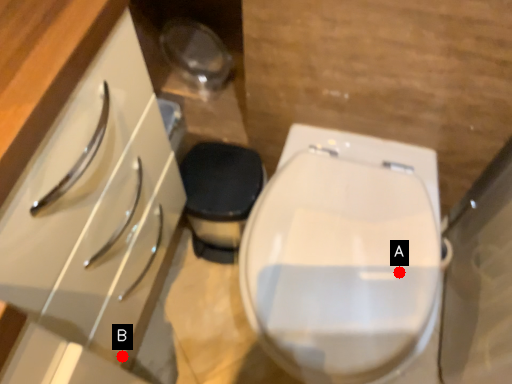
Question: Two points are circled on the image, labeled by A and B beside each circle. Which point is farther from the camera taking this photo?

Choices:
 (A) A is further
 (B) B is further

Answer: (B)